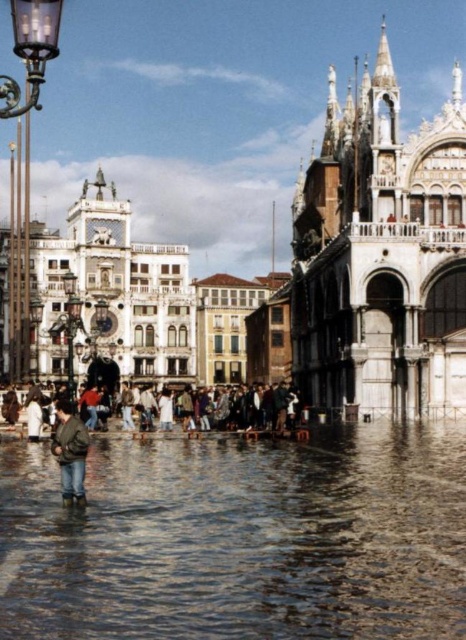
Is point (413, 364) farther from camera compared to point (27, 348)?

No.

Between point (351, 396) and point (74, 282), which one is positioned behind?

Point (74, 282)

Between point (372, 132) and point (157, 355), which one is positioned in front?

Point (372, 132) is in front.

You are a GUI agent. You are given a task and a screenshot of the screen. Output one action in this format:
    pyautogui.click(x=<x>, y=<y>)
    Task: Click on the white marble palace at right
    
    Given the screenshot: What is the action you would take?
    pyautogui.click(x=382, y=256)

This screenshot has width=466, height=640. What do you see at coordinates (382, 256) in the screenshot?
I see `white marble palace at right` at bounding box center [382, 256].

Is point (413, 179) positioned in front of point (219, 412)?

Yes, it is in front of point (219, 412).

Between point (418, 410) and point (253, 392), which one is positioned in front?

Point (418, 410) is more forward.

Locate an element on the screen. white marble palace at right is located at coordinates (382, 256).

Can you confirm if white marble palace at center is taller than green matte jacket at lower left?

Correct, white marble palace at center is much taller as green matte jacket at lower left.

Does white marble palace at center appear on the left side of green matte jacket at lower left?

Correct, you'll find white marble palace at center to the left of green matte jacket at lower left.

Which is in front, point (112, 310) or point (80, 492)?

Point (80, 492) is more forward.

Identify the location of white marble palace at center. This screenshot has height=640, width=466. (100, 298).